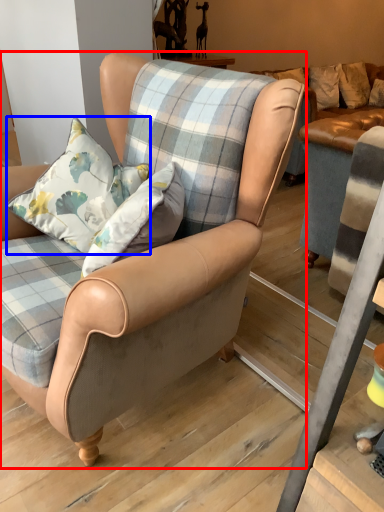
Question: Which object is closer to the camera taking this photo, chair (highlighted by a red box) or pillow (highlighted by a blue box)?

Choices:
 (A) chair
 (B) pillow

Answer: (A)